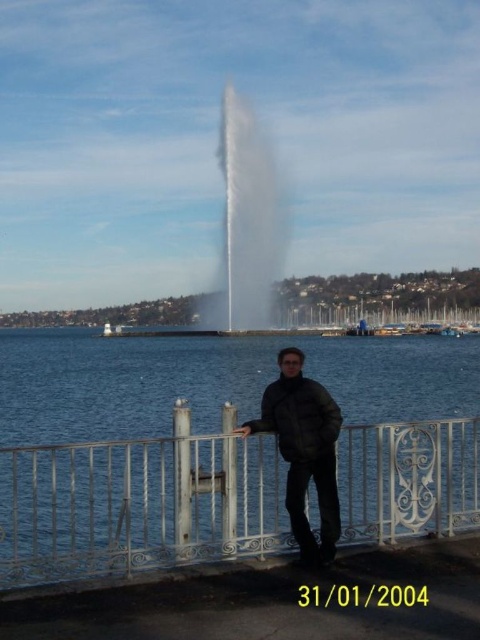
Question: Which object appears farthest from the camera in this image?

Choices:
 (A) black matte jacket at center
 (B) white wrought iron fence at lower center

Answer: (A)

Question: Which of the following is the closest to the observer?

Choices:
 (A) black matte jacket at center
 (B) white wrought iron fence at lower center
 (C) white frothy water at center

Answer: (B)

Question: Does white wrought iron fence at lower center lie behind black matte jacket at center?

Choices:
 (A) yes
 (B) no

Answer: (B)

Question: Is white wrought iron fence at lower center smaller than white frothy water at center?

Choices:
 (A) yes
 (B) no

Answer: (A)

Question: Which of these objects is positioned closest to the white wrought iron fence at lower center?

Choices:
 (A) black matte jacket at center
 (B) white frothy water at center

Answer: (A)

Question: Can you confirm if white wrought iron fence at lower center is positioned above white frothy water at center?

Choices:
 (A) no
 (B) yes

Answer: (A)